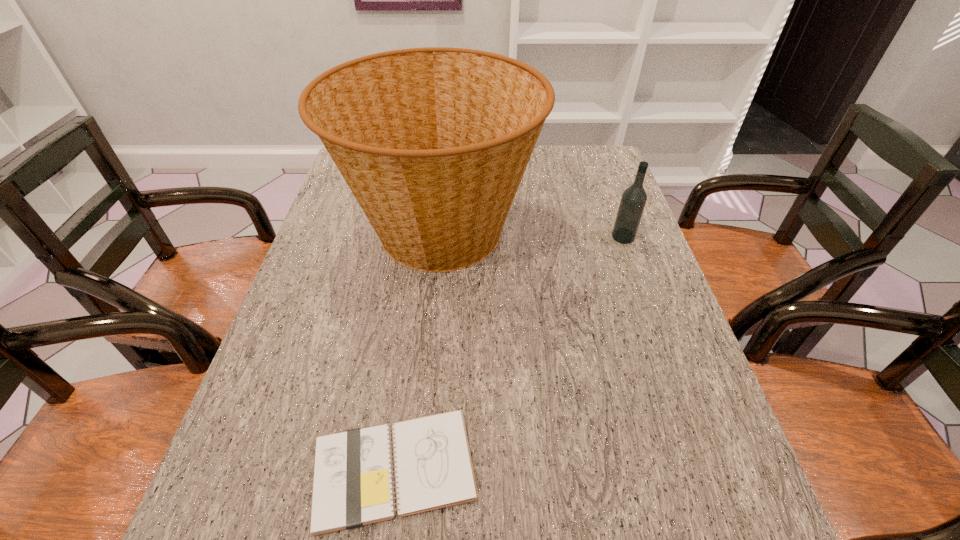
At what (x,y) coordinates should I click in order to perform the action: click on basket that is positioned at the left edge. Please return your answer as a coordinate pair (x, y). The image size is (960, 540). Looking at the image, I should click on (433, 142).

At what (x,y) coordinates should I click in order to perform the action: click on notepad that is at the left edge. Please return your answer as a coordinate pair (x, y). This screenshot has height=540, width=960. Looking at the image, I should click on (353, 483).

Where is `object present at the right edge`? object present at the right edge is located at coordinates (633, 200).

I want to click on object at the far left corner, so click(x=433, y=142).

What are the coordinates of `object at the near left corner` in the screenshot? It's located at (353, 483).

Locate an element on the screen. The image size is (960, 540). free point at the far edge is located at coordinates pyautogui.click(x=538, y=165).

This screenshot has width=960, height=540. In order to click on vacant space at the left edge of the desktop in this screenshot , I will do `click(286, 318)`.

At what (x,y) coordinates should I click in order to perform the action: click on vacant space at the right edge of the desktop. Please return your answer as a coordinate pair (x, y). Looking at the image, I should click on (611, 311).

Where is `vacant space at the near left corner of the desktop`? The height and width of the screenshot is (540, 960). vacant space at the near left corner of the desktop is located at coordinates (222, 525).

Locate an element on the screen. vacant area that lies between the notepad and the second tallest object is located at coordinates (509, 353).